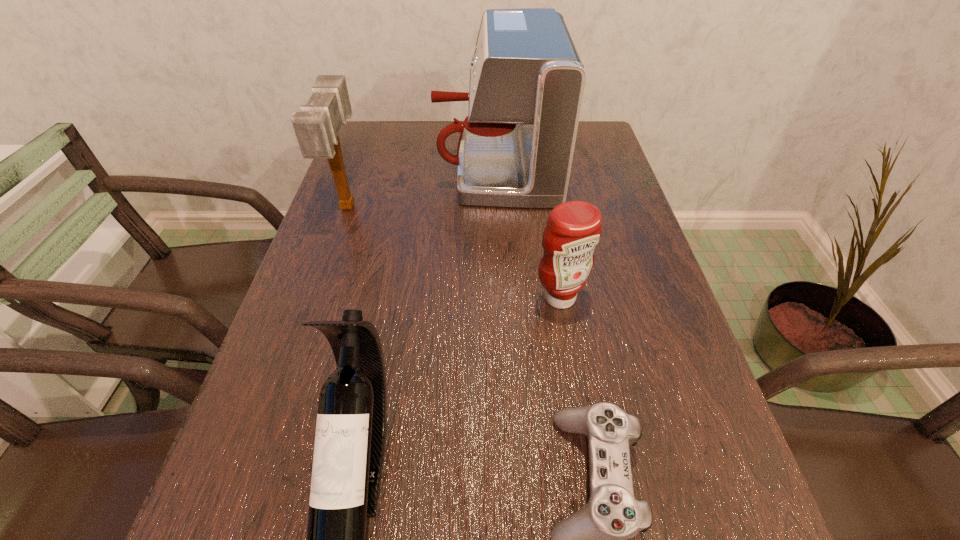
In order to click on the tallest object in this screenshot , I will do `click(516, 146)`.

At what (x,y) coordinates should I click in order to perform the action: click on the leftmost object. Please return your answer as a coordinate pair (x, y). This screenshot has height=540, width=960. Looking at the image, I should click on (316, 127).

Identify the location of condiment. (574, 228).

Find the location of a particular element. This screenshot has height=540, width=960. the third farthest object is located at coordinates (574, 228).

Find the location of a particular element. free space located 0.180m on the front of the tallest object near the spout is located at coordinates (371, 168).

Locate an element on the screen. The height and width of the screenshot is (540, 960). vacant area situated 0.180m on the front of the tallest object near the spout is located at coordinates (371, 168).

Where is `free space located on the front of the tallest object near the spout`? free space located on the front of the tallest object near the spout is located at coordinates (402, 168).

At what (x,y) coordinates should I click in order to perform the action: click on free space located 0.180m on the front of the leftmost object. Please return your answer as a coordinate pair (x, y). Looking at the image, I should click on (320, 289).

The width and height of the screenshot is (960, 540). What are the coordinates of `free location located on the front of the third farthest object` in the screenshot? It's located at (x=579, y=411).

Where is `object that is positioned at the far edge`? The width and height of the screenshot is (960, 540). object that is positioned at the far edge is located at coordinates (516, 146).